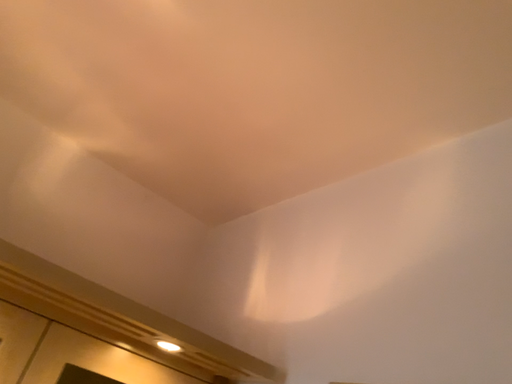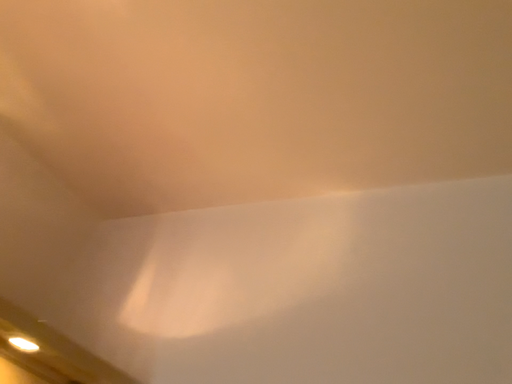
Question: Which way did the camera rotate in the video?

Choices:
 (A) rotated right
 (B) rotated left

Answer: (A)